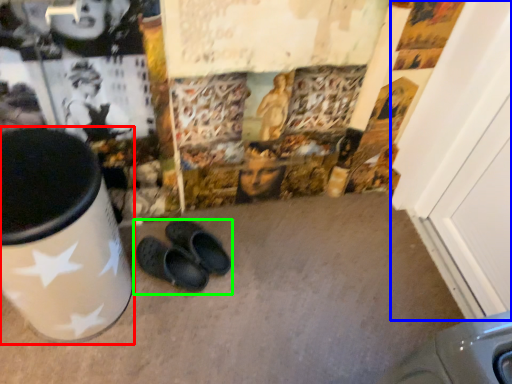
Question: Estimate the real-world distances between objects in this image. Which object is closer to waste container (highlighted by a red box), door (highlighted by a blue box) or footwear (highlighted by a green box)?

Choices:
 (A) door
 (B) footwear

Answer: (B)